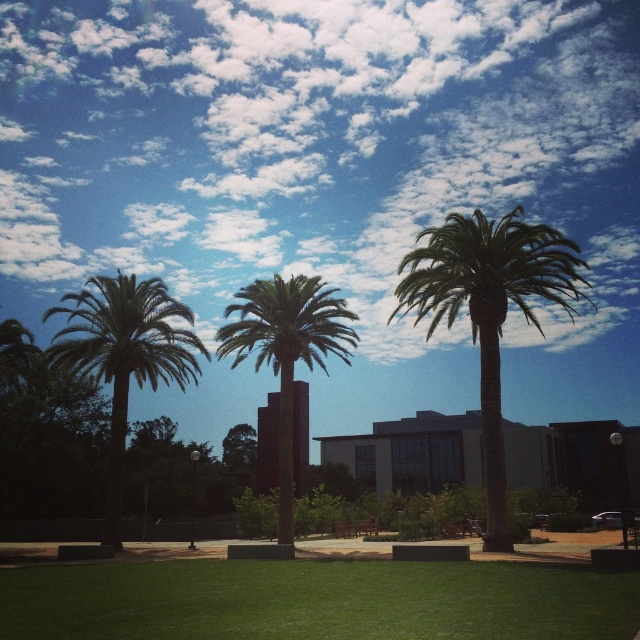
You are standing in the outdoor scene and want to take a photo of the white fluffy cloud at upper center and the green leafy palm tree at left. Which object should you focus on first to ensure both are in clear view?

You should focus on the green leafy palm tree at left first because the white fluffy cloud at upper center is further away from you, so adjusting focus starting from the closer object ensures both are in clear view.

You are standing at the origin point in the image. You see two points labeled as point (157, 346) and point (284, 314). Which point is closer to you?

Point (284, 314) is closer to you because it is in front of point (157, 346).